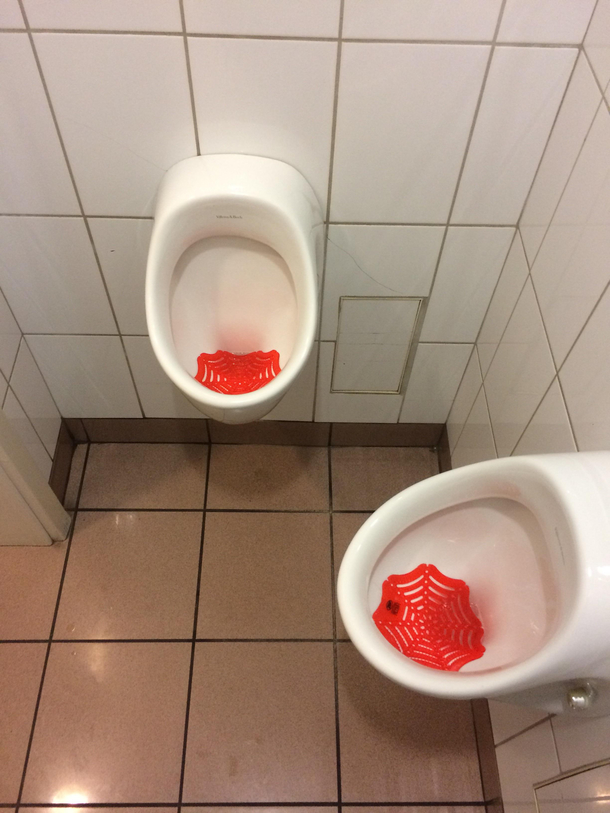
Find the location of a particular element. This screenshot has width=610, height=813. wall is located at coordinates (15, 387), (74, 235), (396, 163), (592, 349), (542, 740).